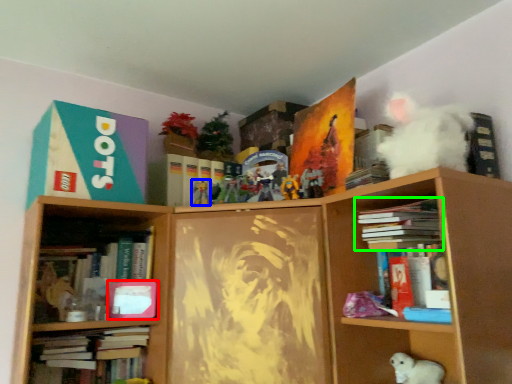
Question: Which object is the closest to the book cover (highlighted by a red box)? Choose among these: toy (highlighted by a blue box) or book (highlighted by a green box).

Choices:
 (A) toy
 (B) book

Answer: (A)